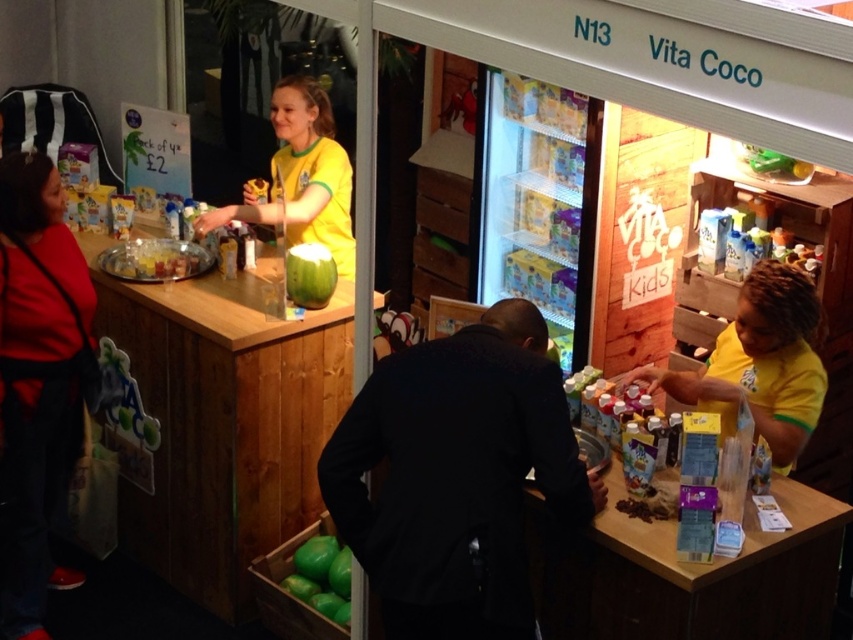
Question: Which point appears closest to the camera in this image?

Choices:
 (A) (323, 228)
 (B) (346, 554)

Answer: (B)

Question: Which object is positioned farthest from the translucent plastic container at center?

Choices:
 (A) black matte jacket at center
 (B) yellow jersey at upper center
 (C) green matte coconut at center

Answer: (A)

Question: Can you confirm if matte red jacket at left is bigger than green matte coconut at center?

Choices:
 (A) no
 (B) yes

Answer: (B)

Question: Considering the real-world distances, which object is farthest from the yellow jersey at upper center?

Choices:
 (A) translucent plastic container at center
 (B) yellow matte shirt at right

Answer: (B)

Question: Is yellow matte shirt at right smaller than green matte coconut at center?

Choices:
 (A) yes
 (B) no

Answer: (B)

Question: Can you confirm if yellow matte shirt at right is bigger than green matte coconut at center?

Choices:
 (A) yes
 (B) no

Answer: (A)